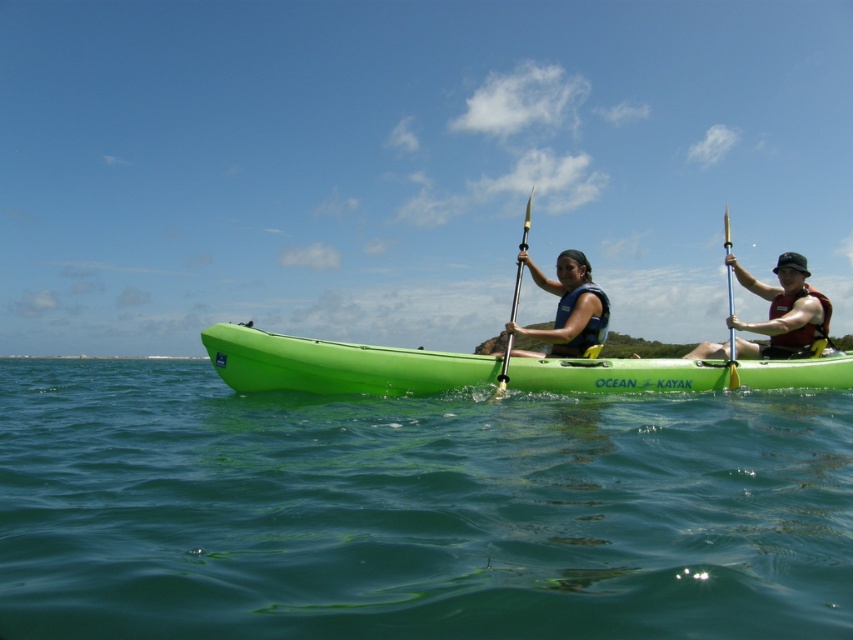
From the picture: You are a safety inspector checking the kayakers. According to the image, is the matte red life vest at right positioned correctly in relation to the green water at center?

The green water at center is in front of the matte red life vest at right, meaning the life vest is behind the water, which is not the correct position for a life vest to be effective. The life vest should be worn by the person on the right and positioned over their torso, not behind them.

You are a safety inspector checking the kayaking setup. The green water at center and yellow metallic pole at center are part of the safety equipment. Which one is positioned lower from the top of the kayak?

The green water at center is below the yellow metallic pole at center, so the green water at center is positioned lower from the top of the kayak.